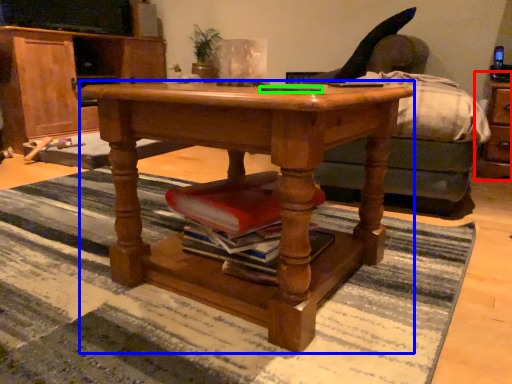
Question: Estimate the real-world distances between objects in this image. Which object is closer to dresser (highlighted by a red box), desk (highlighted by a blue box) or remote control (highlighted by a green box)?

Choices:
 (A) desk
 (B) remote control

Answer: (B)